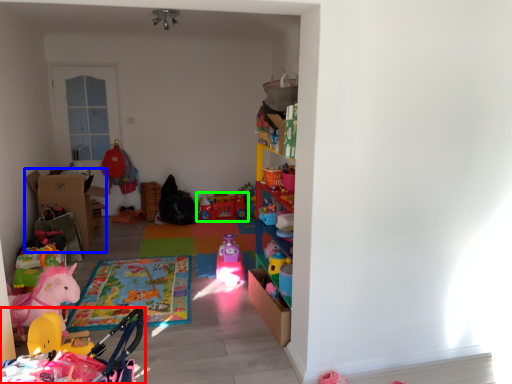
Question: Considering the real-world distances, which object is closest to toy (highlighted by a red box)? cardboard box (highlighted by a blue box) or toy (highlighted by a green box).

Choices:
 (A) cardboard box
 (B) toy

Answer: (B)